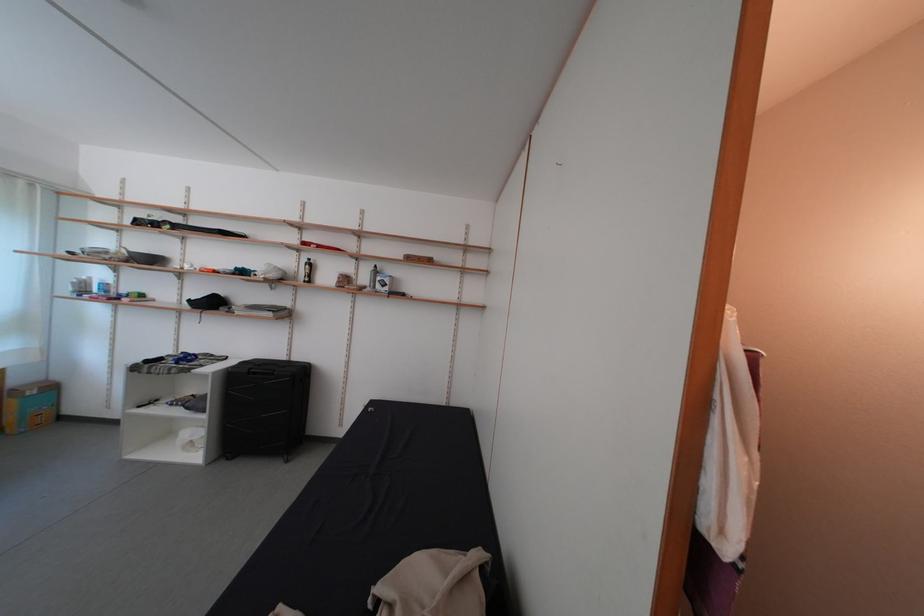
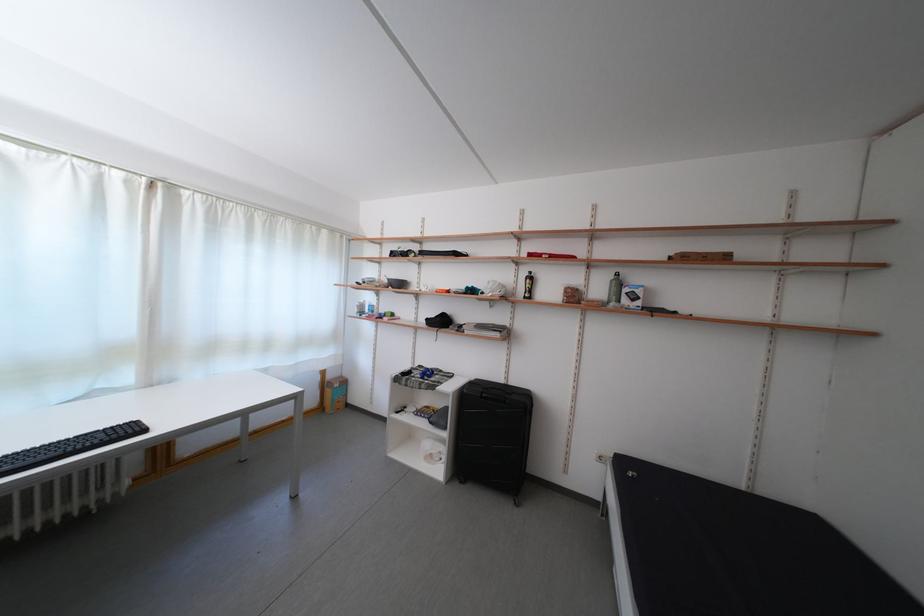
Question: Which direction would the cameraman need to move to produce the second image? Reply with the corresponding letter.

Choices:
 (A) Left
 (B) Right
 (C) Forward
 (D) Backward

Answer: (A)